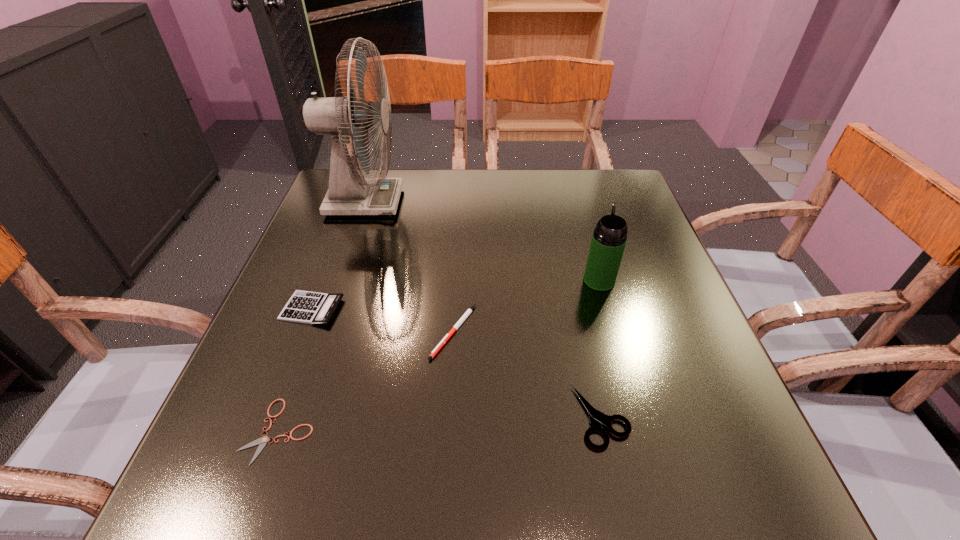
At what (x,y) coordinates should I click in order to perform the action: click on object situated at the right edge. Please return your answer as a coordinate pair (x, y). This screenshot has width=960, height=540. Looking at the image, I should click on (609, 238).

Locate an element on the screen. object present at the far left corner is located at coordinates (343, 117).

Locate an element on the screen. This screenshot has width=960, height=540. object that is at the near left corner is located at coordinates (262, 441).

The width and height of the screenshot is (960, 540). I want to click on vacant space at the far edge of the desktop, so click(x=579, y=211).

I want to click on vacant region at the near edge of the desktop, so click(x=508, y=505).

In the image, there is a desktop. Identify the location of vacant region at the left edge. The height and width of the screenshot is (540, 960). (286, 303).

Locate an element on the screen. The image size is (960, 540). vacant space at the right edge of the desktop is located at coordinates (631, 383).

In the image, there is a desktop. Where is `vacant region at the near right corner`? vacant region at the near right corner is located at coordinates (768, 487).

Locate an element on the screen. The image size is (960, 540). unoccupied position between the second tallest object and the calculator is located at coordinates (456, 294).

Where is `vacant space that is in between the third object from right to left and the calculator`? This screenshot has height=540, width=960. vacant space that is in between the third object from right to left and the calculator is located at coordinates (383, 320).